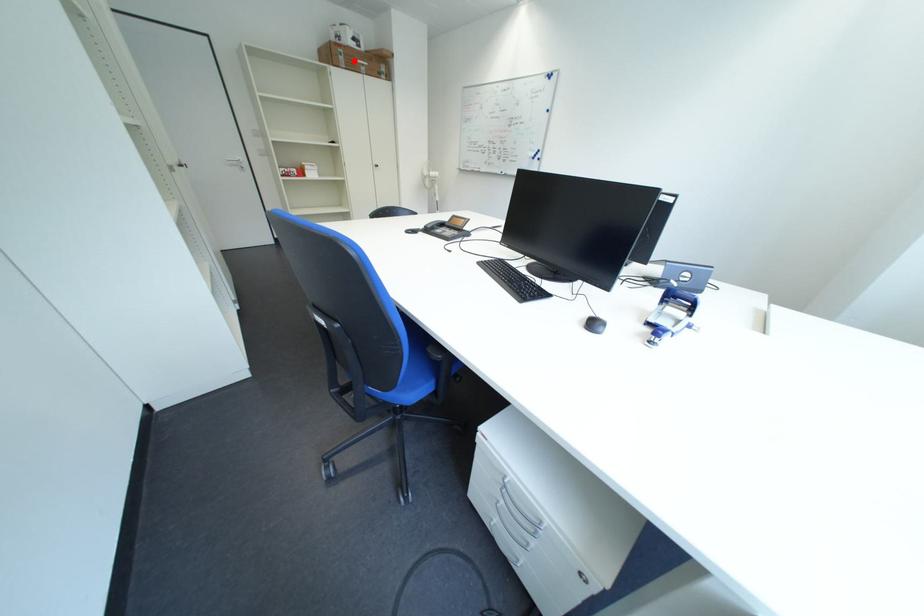
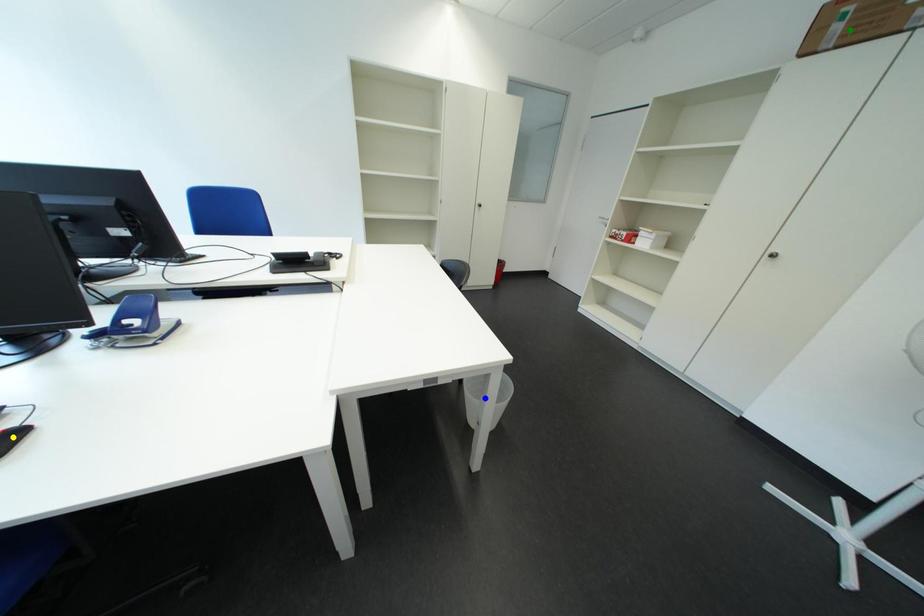
Question: I am providing you with two images of the same scene from different viewpoints. A red point is marked on the first image. You are given multiple points on the second image. In image 2, which mark is for the same physical point as the one in image 1?

Choices:
 (A) yellow point
 (B) blue point
 (C) green point

Answer: (C)